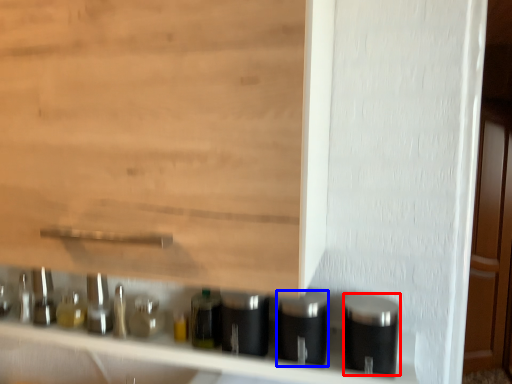
Question: Which object appears closest to the camera in this image, silver (highlighted by a red box) or silver (highlighted by a blue box)?

Choices:
 (A) silver
 (B) silver

Answer: (A)